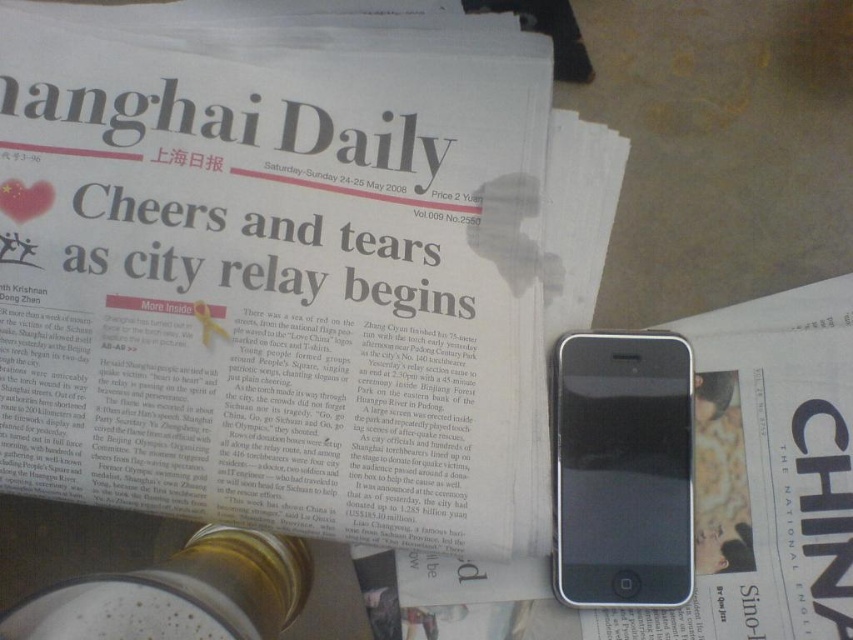
Question: Is white glossy newspaper at upper center thinner than white glossy paper at center?

Choices:
 (A) no
 (B) yes

Answer: (A)

Question: Which point is farther to the camera?

Choices:
 (A) (260, 115)
 (B) (715, 346)
 (C) (572, 486)

Answer: (A)

Question: Which point appears closest to the camera in this image?

Choices:
 (A) (636, 515)
 (B) (790, 493)

Answer: (A)

Question: Where is white glossy newspaper at upper center located in relation to black matte smartphone at lower right in the image?

Choices:
 (A) right
 (B) left

Answer: (B)

Question: Can you confirm if white glossy newspaper at upper center is wider than black matte smartphone at lower right?

Choices:
 (A) no
 (B) yes

Answer: (B)

Question: Which of these objects is positioned farthest from the white glossy paper at center?

Choices:
 (A) white glossy newspaper at upper center
 (B) black matte smartphone at lower right

Answer: (A)